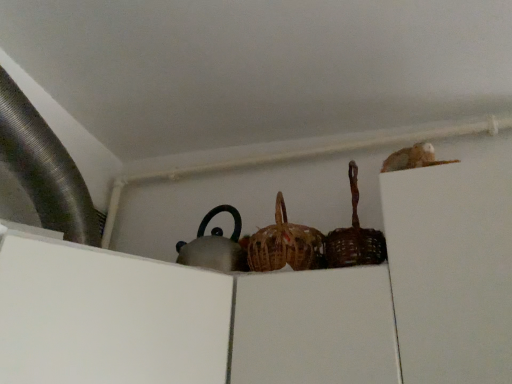
Question: Is brown woven basket at center, the 2th basket positioned from the left, facing away from woven brown basket at center, which is counted as the 1th basket, starting from the left?

Choices:
 (A) no
 (B) yes

Answer: (A)

Question: Considering the relative positions of brown woven basket at center, the 2th basket positioned from the left, and woven brown basket at center, which is counted as the second basket, starting from the right, in the image provided, is brown woven basket at center, the 2th basket positioned from the left, in front of woven brown basket at center, which is counted as the second basket, starting from the right,?

Choices:
 (A) no
 (B) yes

Answer: (B)

Question: Are brown woven basket at center, which appears as the 1th basket when viewed from the right, and woven brown basket at center, which is counted as the second basket, starting from the right, far apart?

Choices:
 (A) no
 (B) yes

Answer: (A)

Question: Is brown woven basket at center, which appears as the 1th basket when viewed from the right, wider than woven brown basket at center, which is counted as the 1th basket, starting from the left?

Choices:
 (A) yes
 (B) no

Answer: (B)

Question: Could woven brown basket at center, which is counted as the second basket, starting from the right, be considered to be inside brown woven basket at center, which appears as the 1th basket when viewed from the right?

Choices:
 (A) yes
 (B) no

Answer: (B)

Question: From a real-world perspective, is brown woven basket at center, which appears as the 1th basket when viewed from the right, on top of woven brown basket at center, which is counted as the 1th basket, starting from the left?

Choices:
 (A) yes
 (B) no

Answer: (B)

Question: From a real-world perspective, is woven brown basket at center, which is counted as the 1th basket, starting from the left, under brown woven basket at center, which appears as the 1th basket when viewed from the right?

Choices:
 (A) no
 (B) yes

Answer: (A)

Question: From a real-world perspective, is woven brown basket at center, which is counted as the 1th basket, starting from the left, positioned over brown woven basket at center, which appears as the 1th basket when viewed from the right, based on gravity?

Choices:
 (A) yes
 (B) no

Answer: (A)

Question: Does woven brown basket at center, which is counted as the 1th basket, starting from the left, have a lesser height compared to brown woven basket at center, the 2th basket positioned from the left?

Choices:
 (A) no
 (B) yes

Answer: (A)

Question: Would you say woven brown basket at center, which is counted as the 1th basket, starting from the left, contains brown woven basket at center, which appears as the 1th basket when viewed from the right?

Choices:
 (A) no
 (B) yes

Answer: (A)

Question: From the image's perspective, is woven brown basket at center, which is counted as the second basket, starting from the right, on brown woven basket at center, the 2th basket positioned from the left?

Choices:
 (A) yes
 (B) no

Answer: (B)

Question: Considering the relative sizes of woven brown basket at center, which is counted as the 1th basket, starting from the left, and brown woven basket at center, the 2th basket positioned from the left, in the image provided, is woven brown basket at center, which is counted as the 1th basket, starting from the left, wider than brown woven basket at center, the 2th basket positioned from the left,?

Choices:
 (A) yes
 (B) no

Answer: (A)

Question: Would you say brown woven basket at center, the 2th basket positioned from the left, is inside or outside woven brown basket at center, which is counted as the 1th basket, starting from the left?

Choices:
 (A) inside
 (B) outside

Answer: (B)